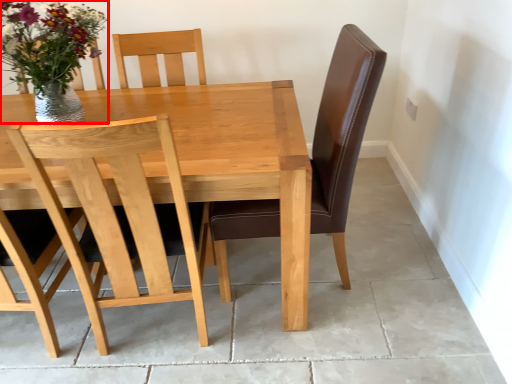
Question: From the image's perspective, what is the correct spatial positioning of floral arrangement (annotated by the red box) in reference to chair?

Choices:
 (A) below
 (B) above

Answer: (B)